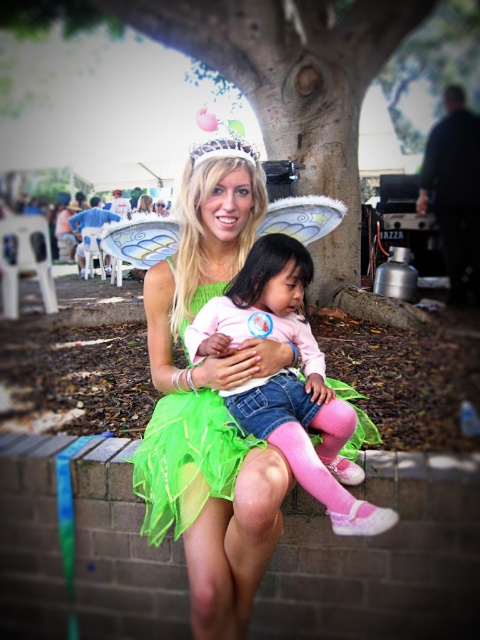
Which is below, green leafy tree at center or pink fabric dress at center?

pink fabric dress at center is below.

Which is above, green leafy tree at center or pink fabric dress at center?

Positioned higher is green leafy tree at center.

Find the location of a particular element. The width and height of the screenshot is (480, 640). green leafy tree at center is located at coordinates coord(294,84).

Who is taller, green tulle dress at center or pink fabric dress at center?

Standing taller between the two is green tulle dress at center.

Who is positioned more to the right, green tulle dress at center or pink fabric dress at center?

Positioned to the right is pink fabric dress at center.

Does point (224, 208) lie behind point (323, 458)?

Yes, it is.

This screenshot has width=480, height=640. Identify the location of green tulle dress at center. (211, 401).

Which is in front, point (233, 556) or point (284, 120)?

Point (233, 556) is more forward.

Based on the photo, between green tulle dress at center and green leafy tree at center, which one is positioned higher?

green leafy tree at center

Who is more forward, (190, 593) or (365, 10)?

Point (190, 593)

Find the location of a particular element. This screenshot has width=480, height=640. green tulle dress at center is located at coordinates (211, 401).